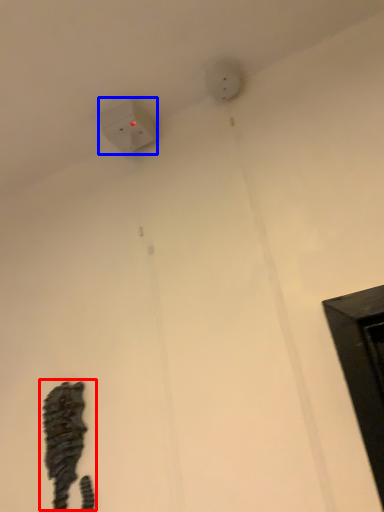
Question: Which point is further to the camera, animal (highlighted by a red box) or power plugs and sockets (highlighted by a blue box)?

Choices:
 (A) animal
 (B) power plugs and sockets

Answer: (B)